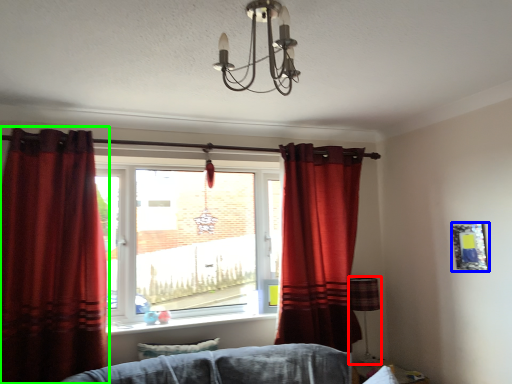
Question: Which is nearer to the lamp (highlighted by a red box)? picture frame (highlighted by a blue box) or curtain (highlighted by a green box).

Choices:
 (A) picture frame
 (B) curtain

Answer: (A)